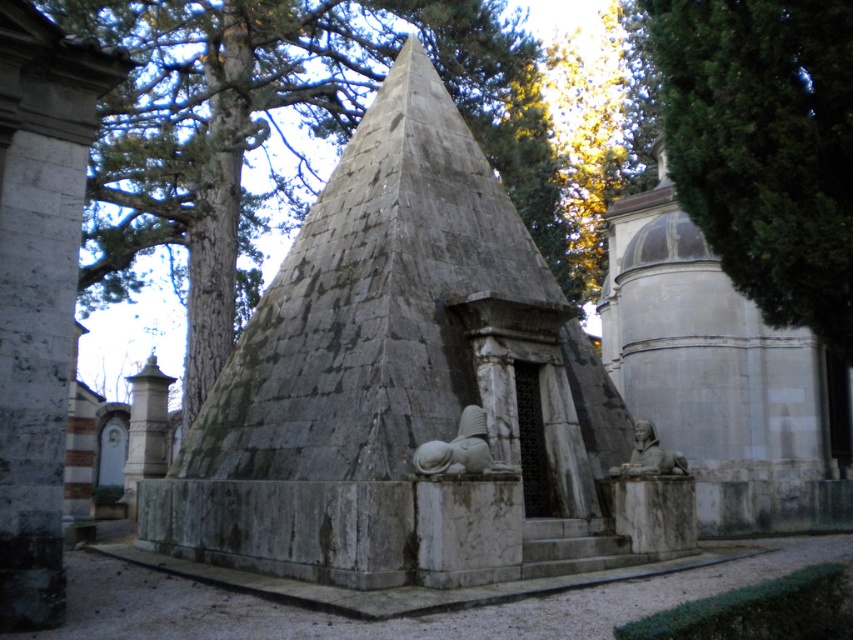
Question: Based on their relative distances, which object is farther from the gray stone pyramid at center?

Choices:
 (A) green leafy tree at upper right
 (B) gray stone lion at center
 (C) green textured tree at center
 (D) gray stone sphinx at lower right

Answer: (C)

Question: Which point is closer to the camera?

Choices:
 (A) gray stone pyramid at center
 (B) gray stone sphinx at lower right
 (C) green textured tree at center
 (D) gray stone lion at center

Answer: (A)

Question: Does green textured tree at center appear on the left side of gray stone sphinx at lower right?

Choices:
 (A) yes
 (B) no

Answer: (A)

Question: Does green textured tree at center appear on the left side of green leafy tree at upper right?

Choices:
 (A) yes
 (B) no

Answer: (A)

Question: Among these points, which one is nearest to the camera?

Choices:
 (A) (468, 454)
 (B) (640, 456)
 (C) (102, 33)
 (D) (821, 8)

Answer: (D)

Question: Is gray stone lion at center to the right of gray stone sphinx at lower right from the viewer's perspective?

Choices:
 (A) no
 (B) yes

Answer: (A)